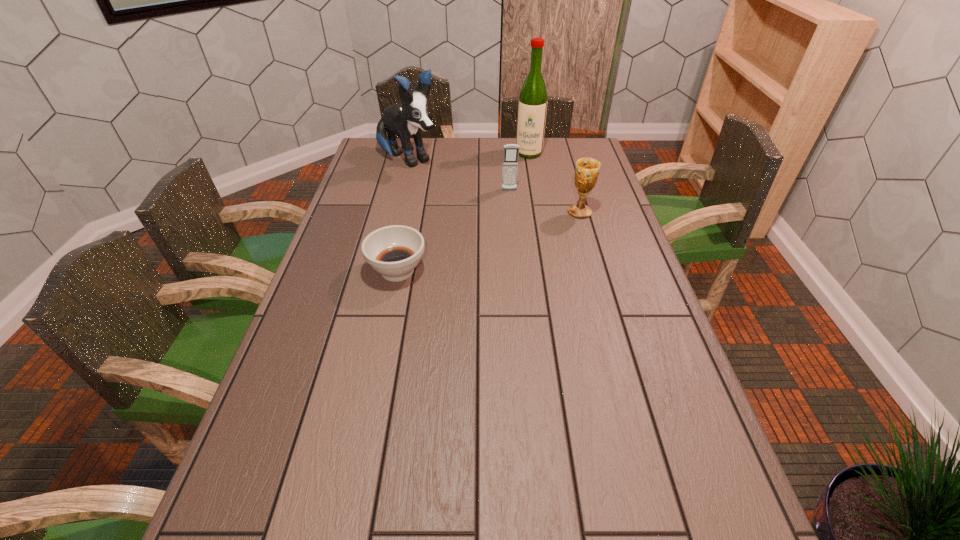
This screenshot has width=960, height=540. I want to click on vacant space at the far right corner of the desktop, so click(x=585, y=150).

This screenshot has height=540, width=960. Identify the location of vacant area that lies between the second tallest object and the second nearest object. (494, 186).

Where is `free space between the fourth object from left to right and the chalice`? free space between the fourth object from left to right and the chalice is located at coordinates (554, 183).

At what (x,y) coordinates should I click in order to perform the action: click on vacant area that lies between the puppy and the third object from right to left. Please return your answer as a coordinate pair (x, y). Image resolution: width=960 pixels, height=540 pixels. Looking at the image, I should click on (459, 175).

Find the location of a particular element. free point between the puppy and the third object from right to left is located at coordinates (459, 175).

Identify the location of free spot between the chalice and the third object from right to left. Image resolution: width=960 pixels, height=540 pixels. click(544, 201).

Identify the location of vacant space that's between the second object from right to left and the third object from right to left. This screenshot has height=540, width=960. (519, 172).

I want to click on free space that is in between the nearest object and the fourth shortest object, so click(403, 215).

Locate an element on the screen. free space that is in between the third nearest object and the shortest object is located at coordinates (453, 231).

Locate an element on the screen. free point between the third object from left to right and the chalice is located at coordinates (544, 201).